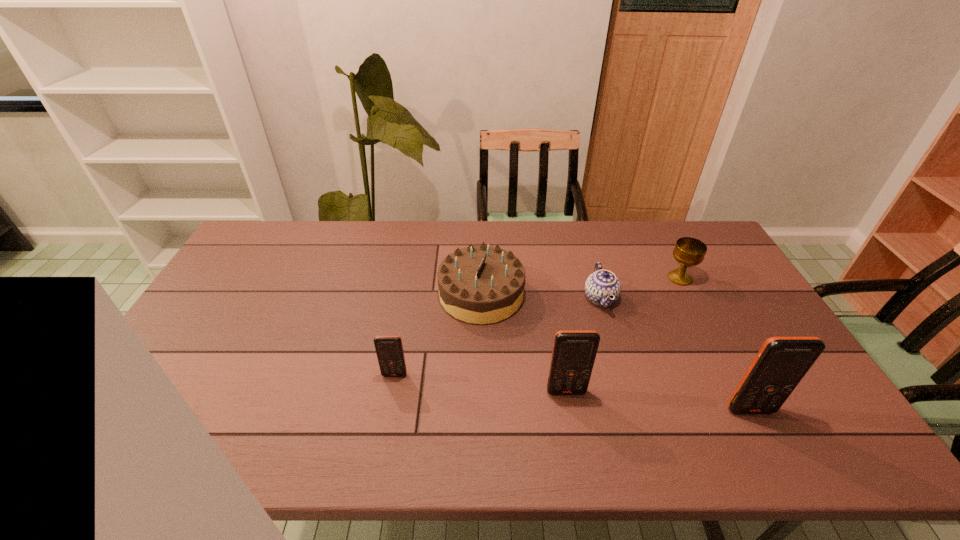
Please point a spot to add another cellular telephone on the left. Please provide its 2D coordinates. Your answer should be formatted as a tuple, i.e. [(x, y)], where the tuple contains the x and y coordinates of a point satisfying the conditions above.

[(234, 359)]